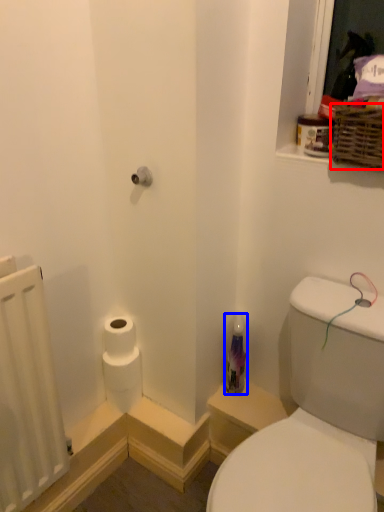
Question: Which of the following is the closest to the observer, basket (highlighted by a red box) or toiletry (highlighted by a blue box)?

Choices:
 (A) basket
 (B) toiletry

Answer: (A)